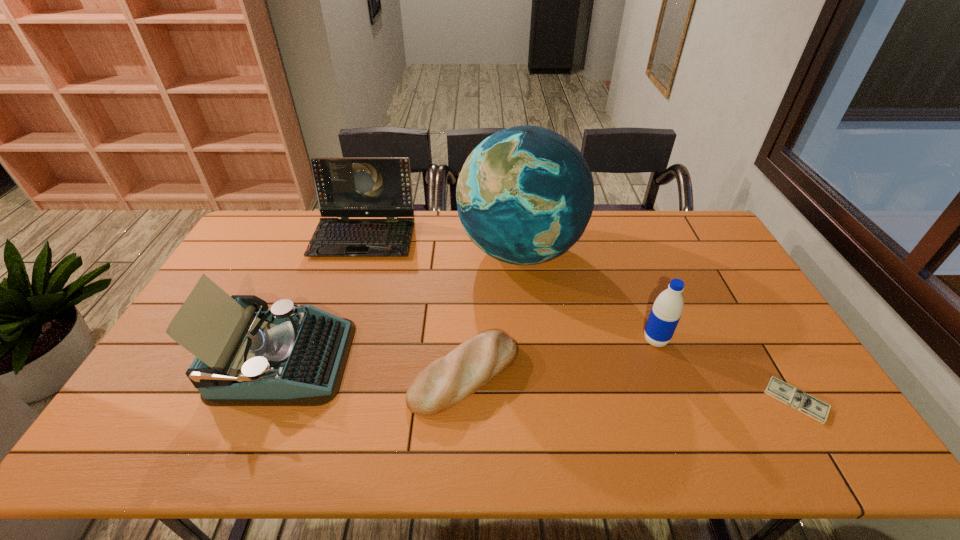
Locate an element on the screen. the tallest object is located at coordinates pyautogui.click(x=525, y=194).

Image resolution: width=960 pixels, height=540 pixels. In order to click on laptop computer in this screenshot , I will do 346,187.

Where is `typewriter`? typewriter is located at coordinates (292, 355).

This screenshot has height=540, width=960. In order to click on water bottle in this screenshot , I will do `click(665, 314)`.

Find the location of a particular element. This screenshot has width=960, height=540. the second shortest object is located at coordinates (448, 380).

I want to click on dollar, so click(803, 402).

Image resolution: width=960 pixels, height=540 pixels. I want to click on the rightmost object, so click(x=803, y=402).

The height and width of the screenshot is (540, 960). I want to click on blank space located 0.260m on the left of the globe, so click(385, 251).

This screenshot has height=540, width=960. Find the location of `free space located on the screen of the laptop computer`. free space located on the screen of the laptop computer is located at coordinates (349, 279).

Find the location of a particular element. The width and height of the screenshot is (960, 540). free space located 0.220m on the typing side of the typewriter is located at coordinates (428, 360).